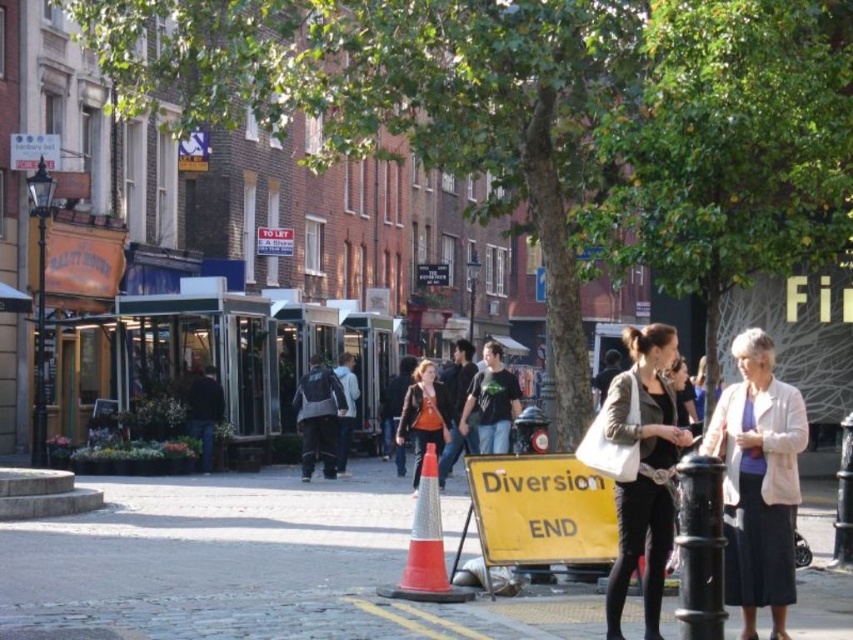
You are a pedestrian trying to navigate the street and see the light beige jacket at lower right and the leather jacket at center. Which jacket is positioned closer to the right side of the street?

The light beige jacket at lower right is positioned to the right of the leather jacket at center, so it is closer to the right side of the street.

You are a delivery person trying to navigate through the street. You see the orange reflective cone at center and the leather jacket at center. Which object is blocking your path?

The orange reflective cone at center is positioned under the leather jacket at center, meaning the leather jacket at center is above it. Since the jacket is at the same center position, it might be hanging over the cone, potentially blocking the path. However, since the cone is at ground level and the jacket is likely worn by a person standing there, the person with the leather jacket at center is obstructing the path more directly.